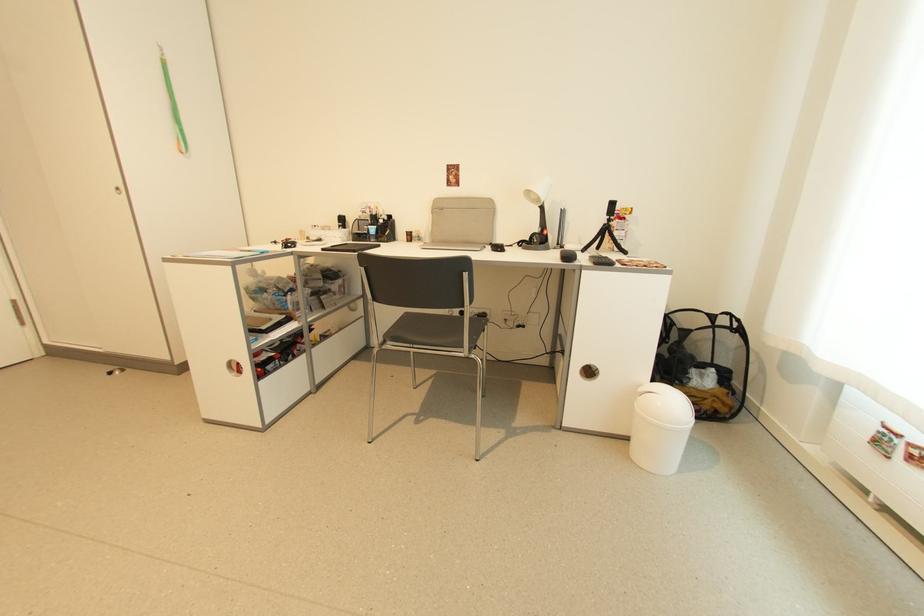
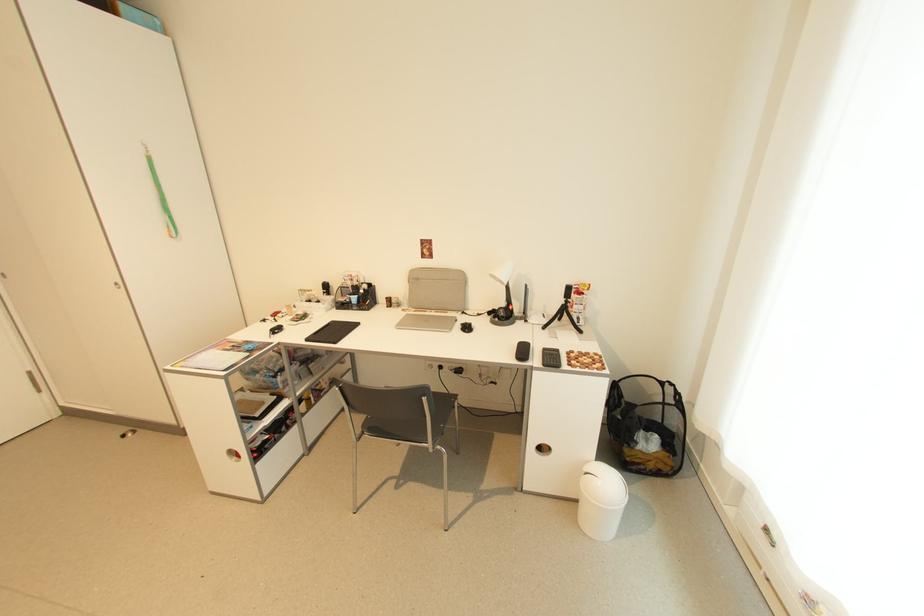
The point at (x=697, y=386) is marked in the first image. Where is the corresponding point in the second image?

(642, 450)